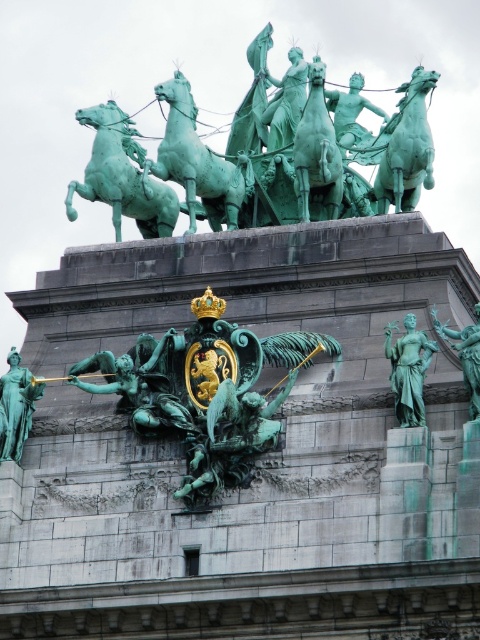
Question: Which point is farther to the camera?

Choices:
 (A) (216, 221)
 (B) (173, 376)
 (C) (4, 440)
 (D) (115, 225)

Answer: (D)

Question: Is green patinated metal emblem at center bigger than green patinated statue at center-right?

Choices:
 (A) no
 (B) yes

Answer: (A)

Question: Based on their relative distances, which object is farther from the green patinated metal horse at center?

Choices:
 (A) green patinated metal emblem at center
 (B) green patina statue at right
 (C) green patina statue at left
 (D) green patinated statue at center-right

Answer: (B)

Question: Which object appears closest to the camera in this image?

Choices:
 (A) green patina statue at left
 (B) green patinated metal horse at center
 (C) green patina statue at right

Answer: (C)

Question: Is green patina chariot at upper center bigger than green patina horse at upper center?

Choices:
 (A) yes
 (B) no

Answer: (A)

Question: Observing the image, what is the correct spatial positioning of green patinated metal horse at upper center in reference to green patinated metal horse at center?

Choices:
 (A) right
 (B) left

Answer: (A)